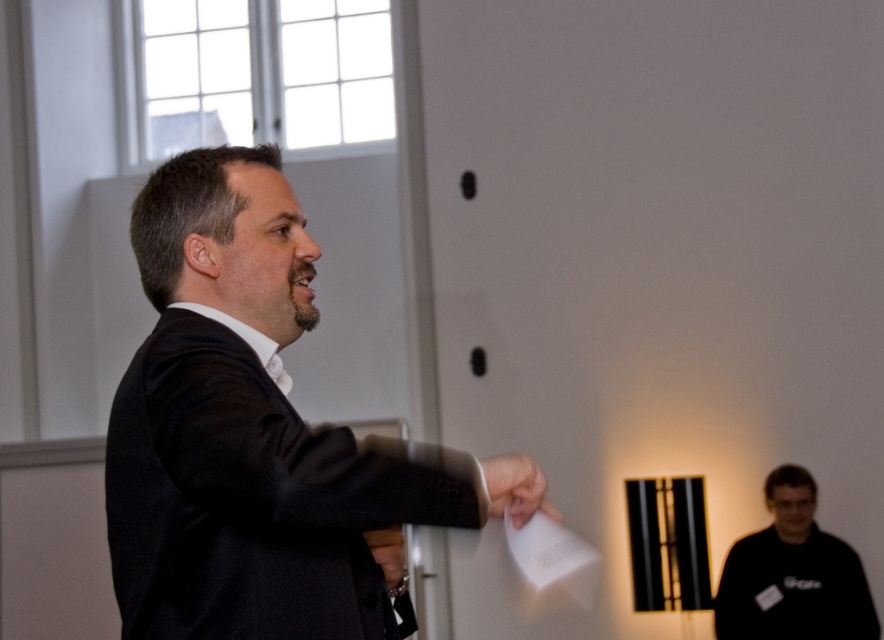
Does black matte shirt at lower right have a lesser width compared to white paper at center?

No, black matte shirt at lower right is not thinner than white paper at center.

Is black matte shirt at lower right to the right of white paper at center from the viewer's perspective?

Correct, you'll find black matte shirt at lower right to the right of white paper at center.

Does point (775, 540) come behind point (531, 500)?

Yes, it is.

At what (x,y) coordinates should I click in order to perform the action: click on black matte shirt at lower right. Please return your answer as a coordinate pair (x, y). This screenshot has width=884, height=640. Looking at the image, I should click on (791, 573).

Is black matte suit at center smaller than white paper at center?

No.

Which of these two, black matte suit at center or white paper at center, stands shorter?

white paper at center

Is point (280, 253) farther from camera compared to point (545, 477)?

No.

Find the location of a particular element. The height and width of the screenshot is (640, 884). black matte suit at center is located at coordinates (249, 433).

What do you see at coordinates (249, 433) in the screenshot? The width and height of the screenshot is (884, 640). I see `black matte suit at center` at bounding box center [249, 433].

Does black matte suit at center lie behind black matte shirt at lower right?

That is False.

Where is `black matte suit at center`? black matte suit at center is located at coordinates (249, 433).